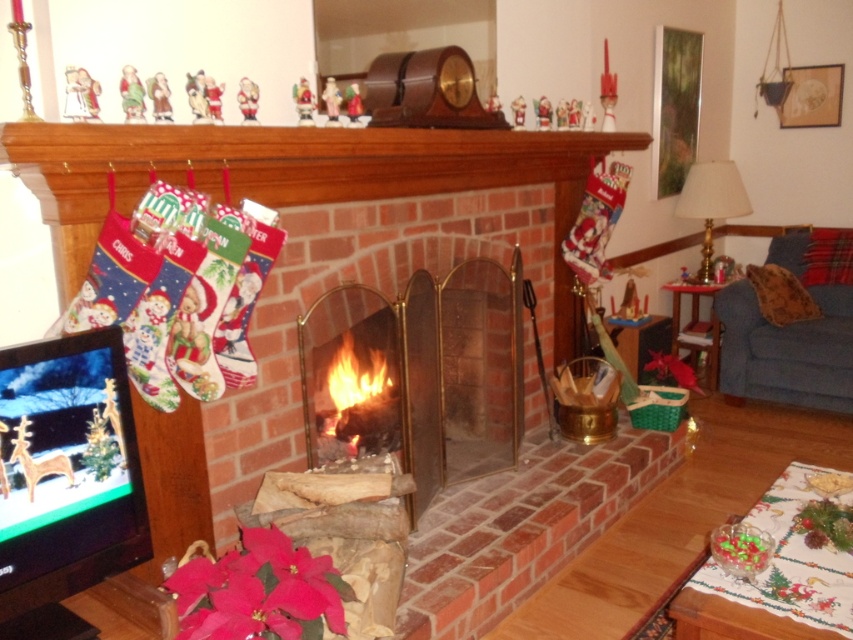
Can you confirm if brick fireplace at center is wider than blue fabric couch at lower right?

Yes.

Between brick fireplace at center and blue fabric couch at lower right, which one appears on the right side from the viewer's perspective?

From the viewer's perspective, blue fabric couch at lower right appears more on the right side.

Based on the photo, measure the distance between brick fireplace at center and camera.

brick fireplace at center is 4.62 feet away from camera.

I want to click on brick fireplace at center, so tap(299, 176).

Is pink matte poinsettia at lower left behind blue fabric couch at lower right?

No, it is not.

Between pink matte poinsettia at lower left and blue fabric couch at lower right, which one has less height?

pink matte poinsettia at lower left

Which is behind, point (231, 632) or point (824, 349)?

Point (824, 349)

Locate an element on the screen. Image resolution: width=853 pixels, height=640 pixels. pink matte poinsettia at lower left is located at coordinates (259, 592).

Between brick fireplace at center and pink matte poinsettia at lower left, which one has less height?

Standing shorter between the two is pink matte poinsettia at lower left.

Is point (178, 179) less distant than point (328, 579)?

No.

I want to click on brick fireplace at center, so click(x=299, y=176).